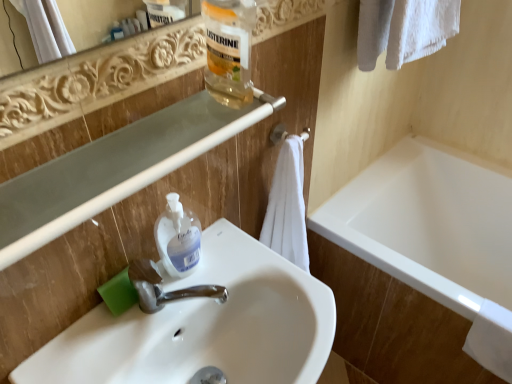
Where is `vacant space in front of translucent plastic bottle at upper center`? vacant space in front of translucent plastic bottle at upper center is located at coordinates (183, 142).